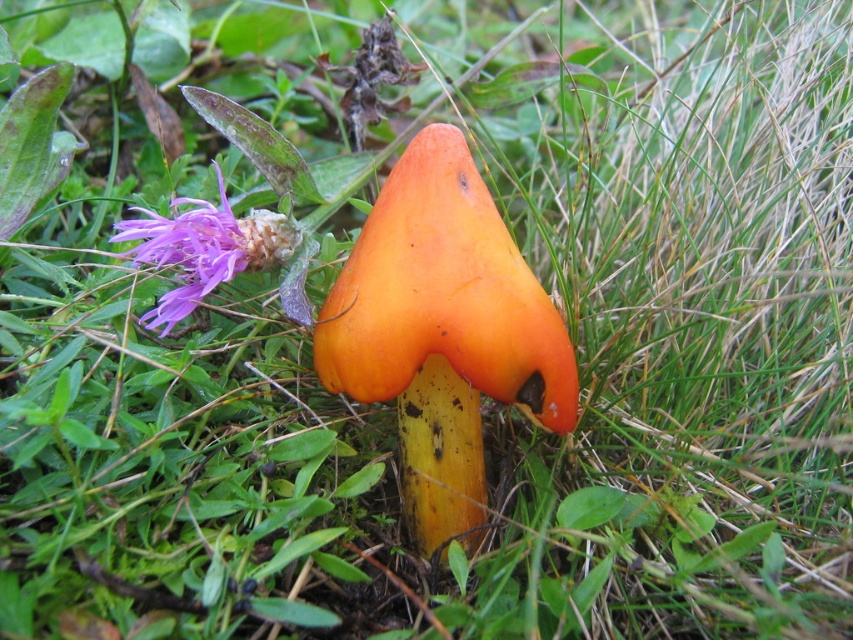
Question: Can you confirm if orange matte mushroom at center is positioned to the right of orange matte mushroom at upper left?

Choices:
 (A) yes
 (B) no

Answer: (A)

Question: Where is orange matte mushroom at center located in relation to orange matte mushroom at upper left in the image?

Choices:
 (A) right
 (B) left

Answer: (A)

Question: Does orange matte mushroom at center lie in front of orange matte mushroom at upper left?

Choices:
 (A) yes
 (B) no

Answer: (A)

Question: Which of the following is the farthest from the observer?

Choices:
 (A) orange matte mushroom at center
 (B) orange matte mushroom at upper left

Answer: (B)

Question: Which of the following is the closest to the observer?

Choices:
 (A) (448, 208)
 (B) (296, 230)

Answer: (A)